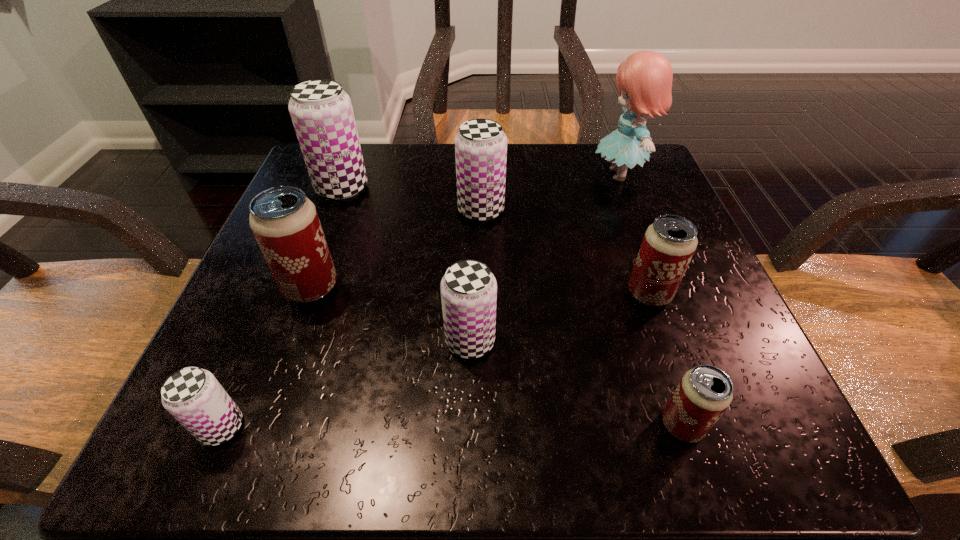
Identify which red beer can is the second closest to the tallest object. Please provide its 2D coordinates. Your answer should be formatted as a tuple, i.e. [(x, y)], where the tuple contains the x and y coordinates of a point satisfying the conditions above.

[(704, 393)]

I want to click on vacant area in the image that satisfies the following two spatial constraints: 1. on the front side of the third smallest purple beer can; 2. on the left side of the nearest red beer can, so (x=481, y=425).